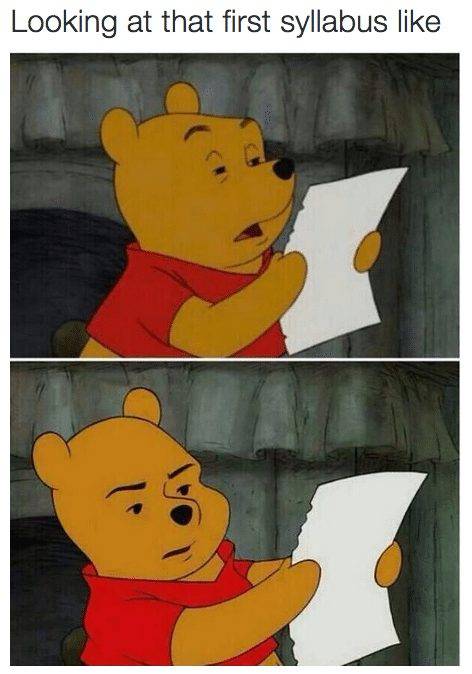
The width and height of the screenshot is (472, 674). I want to click on curtains in the background, so (x=325, y=109), (x=280, y=423).